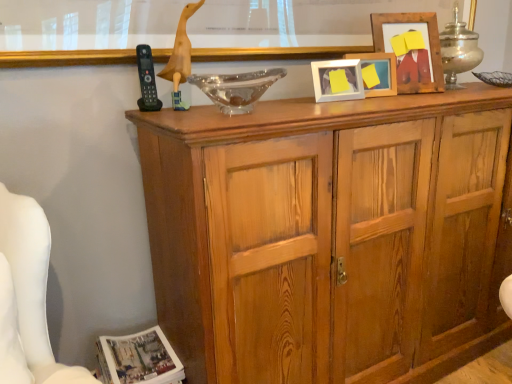
I want to click on vacant area that is in front of white matte picture frame at upper center, arranged as the 1th picture frame when viewed from the left, so click(x=353, y=99).